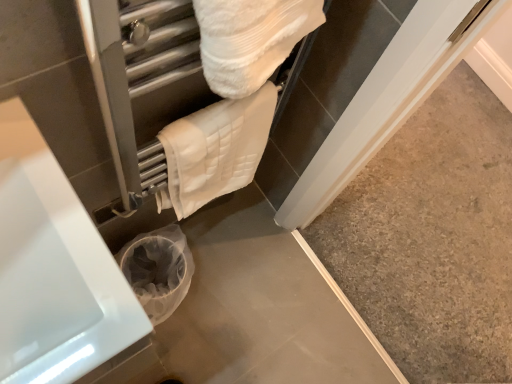
What do you see at coordinates (215, 150) in the screenshot? This screenshot has height=384, width=512. I see `white quilted towel at upper center` at bounding box center [215, 150].

You are a GUI agent. You are given a task and a screenshot of the screen. Output one action in this format:
    pyautogui.click(x=<x>, y=<y>)
    Task: Click on the white quilted towel at upper center
    
    Given the screenshot: What is the action you would take?
    pyautogui.click(x=215, y=150)

The height and width of the screenshot is (384, 512). Identify the location of white glossy bathtub at lower left. (55, 270).

What do you see at coordinates (55, 270) in the screenshot? I see `white glossy bathtub at lower left` at bounding box center [55, 270].

Identify the location of white quilted towel at upper center. (215, 150).

Which is more to the left, white quilted towel at upper center or white glossy bathtub at lower left?

Positioned to the left is white glossy bathtub at lower left.

Based on the photo, is white quilted towel at upper center positioned behind white glossy bathtub at lower left?

Yes, the depth of white quilted towel at upper center is greater than that of white glossy bathtub at lower left.

Between point (251, 110) and point (35, 376), which one is positioned in front?

The point (35, 376) is in front.

From the image's perspective, is white quilted towel at upper center on top of white glossy bathtub at lower left?

Yes.

From a real-world perspective, is white quilted towel at upper center on top of white glossy bathtub at lower left?

Yes, from a real-world perspective, white quilted towel at upper center is on top of white glossy bathtub at lower left.

Can you confirm if white quilted towel at upper center is thinner than white glossy bathtub at lower left?

Indeed, white quilted towel at upper center has a lesser width compared to white glossy bathtub at lower left.

Does white quilted towel at upper center have a lesser height compared to white glossy bathtub at lower left?

Yes, white quilted towel at upper center is shorter than white glossy bathtub at lower left.

Does white quilted towel at upper center have a larger size compared to white glossy bathtub at lower left?

Incorrect, white quilted towel at upper center is not larger than white glossy bathtub at lower left.

Is white quilted towel at upper center surrounding white glossy bathtub at lower left?

Actually, white glossy bathtub at lower left is outside white quilted towel at upper center.

Would you consider white quilted towel at upper center to be distant from white glossy bathtub at lower left?

No, white quilted towel at upper center is in close proximity to white glossy bathtub at lower left.

Is white quilted towel at upper center facing away from white glossy bathtub at lower left?

No, white quilted towel at upper center is not facing the opposite direction of white glossy bathtub at lower left.

Measure the distance from white quilted towel at upper center to white glossy bathtub at lower left.

white quilted towel at upper center is 15.03 inches away from white glossy bathtub at lower left.

This screenshot has height=384, width=512. In order to click on bath on the left of white quilted towel at upper center in this screenshot , I will do `click(55, 270)`.

Does white glossy bathtub at lower left appear on the left side of white quilted towel at upper center?

Yes, white glossy bathtub at lower left is to the left of white quilted towel at upper center.

Which object is closer to the camera taking this photo, white glossy bathtub at lower left or white quilted towel at upper center?

Positioned in front is white glossy bathtub at lower left.

Considering the points (0, 196) and (256, 92), which point is behind, point (0, 196) or point (256, 92)?

The point (256, 92) is more distant.

From the image's perspective, is white glossy bathtub at lower left located beneath white quilted towel at upper center?

Correct, white glossy bathtub at lower left appears lower than white quilted towel at upper center in the image.

From a real-world perspective, relative to white quilted towel at upper center, is white glossy bathtub at lower left vertically above or below?

Clearly, from a real-world perspective, white glossy bathtub at lower left is below white quilted towel at upper center.

Is white glossy bathtub at lower left wider than white quilted towel at upper center?

Correct, the width of white glossy bathtub at lower left exceeds that of white quilted towel at upper center.

Between white glossy bathtub at lower left and white quilted towel at upper center, which one has more height?

white glossy bathtub at lower left is taller.

Can you confirm if white glossy bathtub at lower left is bigger than white quilted towel at upper center?

Yes.

Is white glossy bathtub at lower left located outside white quilted towel at upper center?

white glossy bathtub at lower left lies outside white quilted towel at upper center's area.

Would you consider white glossy bathtub at lower left to be distant from white quilted towel at upper center?

Actually, white glossy bathtub at lower left and white quilted towel at upper center are a little close together.

Could you tell me if white glossy bathtub at lower left is turned towards white quilted towel at upper center?

No, white glossy bathtub at lower left is not oriented towards white quilted towel at upper center.

How different are the orientations of white glossy bathtub at lower left and white quilted towel at upper center in degrees?

white glossy bathtub at lower left and white quilted towel at upper center are facing 1.89 degrees away from each other.

How distant is white glossy bathtub at lower left from white quilted towel at upper center?

38.18 centimeters.

You are a GUI agent. You are given a task and a screenshot of the screen. Output one action in this format:
    pyautogui.click(x=<x>, y=<y>)
    Task: Click on the towel located behind the white glossy bathtub at lower left
    This screenshot has width=512, height=384.
    Given the screenshot: What is the action you would take?
    pyautogui.click(x=215, y=150)

Locate an element on the screen. Image resolution: width=512 pixels, height=384 pixels. towel above the white glossy bathtub at lower left (from the image's perspective) is located at coordinates (215, 150).

What are the coordinates of `towel above the white glossy bathtub at lower left (from a real-world perspective)` in the screenshot? It's located at (215, 150).